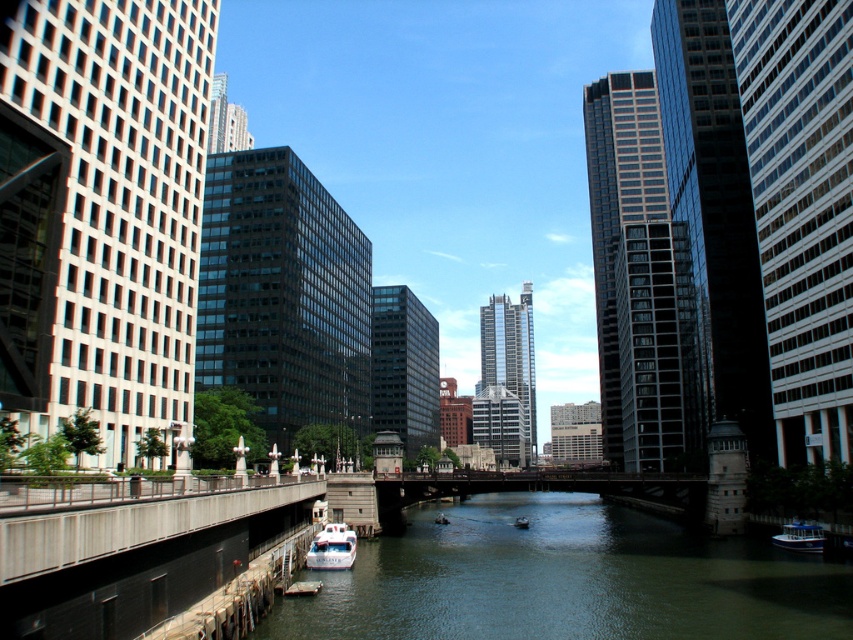
You are standing on the bridge overlooking the river. You see the greenish water at center and the white plastic boat at center. Which object is positioned higher from your viewpoint?

The greenish water at center is located above the white plastic boat at center, so it is positioned higher from your viewpoint.

You are standing on the bridge looking down at the river. You see the greenish water at center and the white plastic boat at center. From your vantage point, which object is positioned to the right?

The greenish water at center is to the right of the white plastic boat at center, so the greenish water at center is positioned to the right.

You are standing on the bridge in the middle ground of the urban scene. Looking down, you notice a specific point marked as point (x=566, y=579). What is the nature of the surface at this point?

The surface at point (x=566, y=579) is greenish water at center.